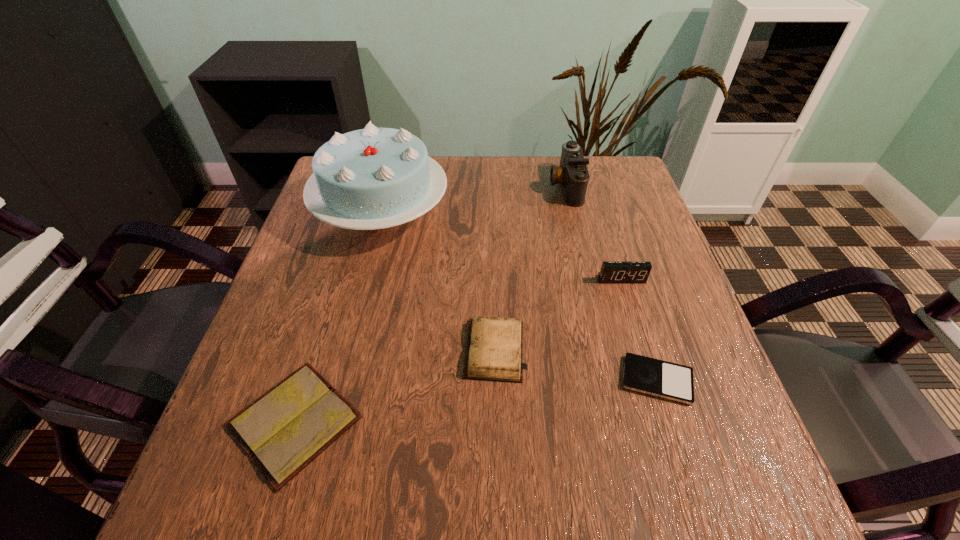
Find the location of a particular element. This screenshot has height=540, width=960. the tallest object is located at coordinates (373, 178).

The image size is (960, 540). Identify the location of the second tallest object. (572, 174).

Where is `alarm clock`? The height and width of the screenshot is (540, 960). alarm clock is located at coordinates (611, 272).

Where is `the fourth shortest object`? the fourth shortest object is located at coordinates click(611, 272).

Identify the location of the taller diary. (494, 351).

Find the location of a particular element. Image resolution: width=960 pixels, height=540 pixels. the fourth object from right to left is located at coordinates (494, 351).

Where is `the left diary`? The height and width of the screenshot is (540, 960). the left diary is located at coordinates (284, 430).

What are the coordinates of `the fifth tallest object` in the screenshot? It's located at (284, 430).

You are a GUI agent. You are given a task and a screenshot of the screen. Output one action in this format:
    pyautogui.click(x=<x>, y=<y>)
    Task: Click on the iPod
    The image size is (960, 540).
    Given the screenshot: What is the action you would take?
    pyautogui.click(x=655, y=377)

Image resolution: width=960 pixels, height=540 pixels. In order to click on vacant area situated 0.180m on the front of the tallest object in this screenshot , I will do `click(355, 321)`.